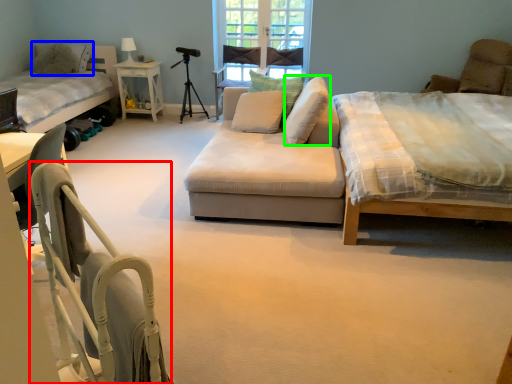
Question: Based on their relative distances, which object is nearer to folding chair (highlighted by a red box)? Choose from pillow (highlighted by a blue box) and pillow (highlighted by a green box).

Choices:
 (A) pillow
 (B) pillow

Answer: (B)